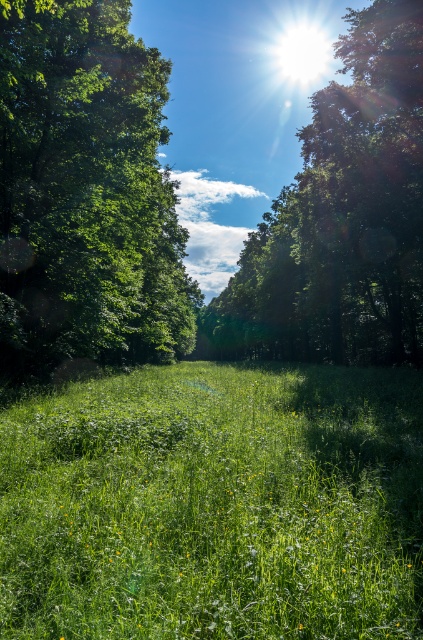
This screenshot has width=423, height=640. Identify the location of green leafy tree at left. (85, 193).

I want to click on green leafy tree at left, so click(85, 193).

Does green grassy field at center appear on the right side of green leafy tree at upper center?

No, green grassy field at center is not to the right of green leafy tree at upper center.

Looking at this image, between green grassy field at center and green leafy tree at upper center, which one appears on the right side from the viewer's perspective?

Positioned to the right is green leafy tree at upper center.

What do you see at coordinates (214, 504) in the screenshot?
I see `green grassy field at center` at bounding box center [214, 504].

Identify the location of green grassy field at center. (214, 504).

Is green grassy field at center taller than green leafy tree at left?

In fact, green grassy field at center may be shorter than green leafy tree at left.

Is point (137, 618) positioned in front of point (181, 285)?

Yes.

Where is `green grassy field at center`? Image resolution: width=423 pixels, height=640 pixels. green grassy field at center is located at coordinates (214, 504).